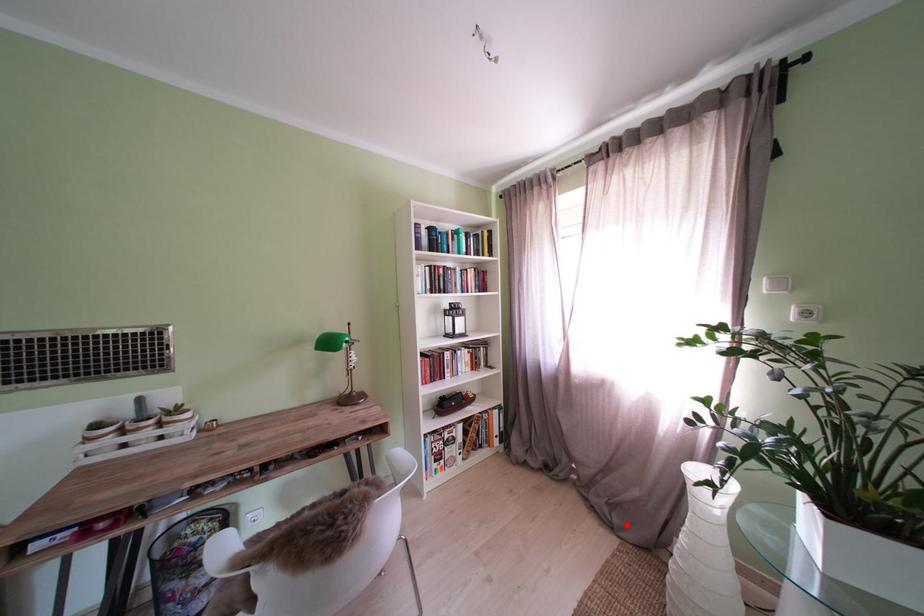
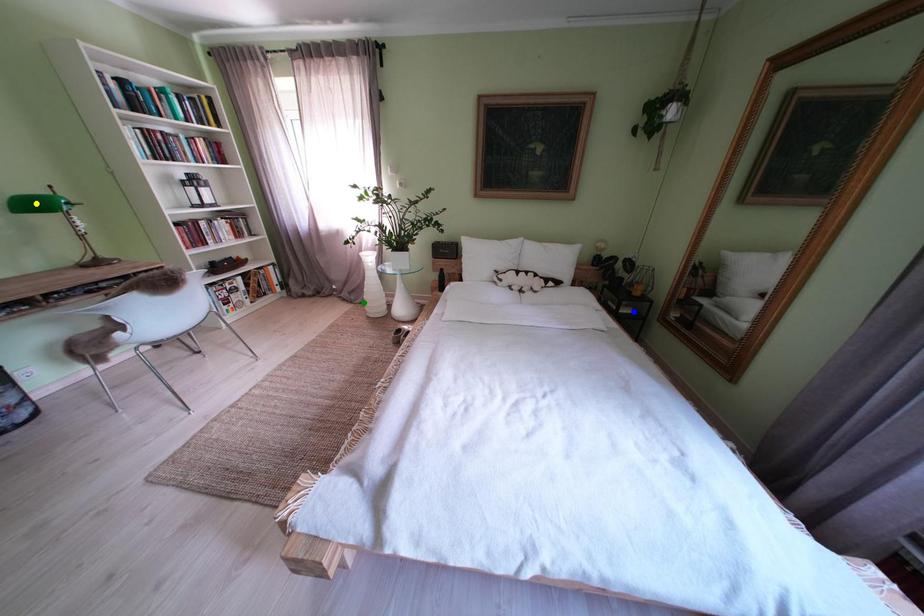
Question: I am providing you with two images of the same scene from different viewpoints. A red point is marked on the first image. You are given multiple points on the second image. Which point in image 2 represents the same 3d spot as the red point in image 1?

Choices:
 (A) blue point
 (B) yellow point
 (C) green point

Answer: (C)